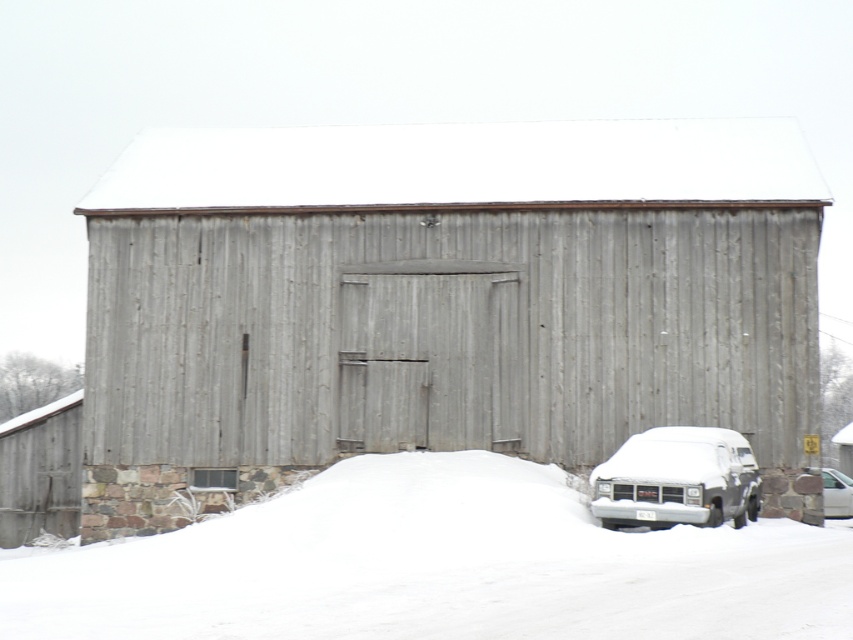
Question: Where is snow-covered van at lower right located in relation to white matte van at lower right in the image?

Choices:
 (A) above
 (B) below

Answer: (A)

Question: Can you confirm if weathered wood barn at center is bigger than white matte van at lower right?

Choices:
 (A) no
 (B) yes

Answer: (B)

Question: In this image, where is white fluffy snow at lower center located relative to white matte van at lower right?

Choices:
 (A) below
 (B) above

Answer: (B)

Question: Which is farther from the snow-covered van at lower right?

Choices:
 (A) weathered wood barn at center
 (B) white matte van at lower right
 (C) white fluffy snow at lower center

Answer: (A)

Question: Which point appears closest to the camera in this image?

Choices:
 (A) (277, 609)
 (B) (747, 460)
 (C) (846, 490)
 (D) (279, 228)

Answer: (A)

Question: Which point is closer to the camera taking this photo?

Choices:
 (A) pyautogui.click(x=590, y=602)
 (B) pyautogui.click(x=663, y=436)
 (C) pyautogui.click(x=519, y=362)
 (D) pyautogui.click(x=834, y=476)

Answer: (A)